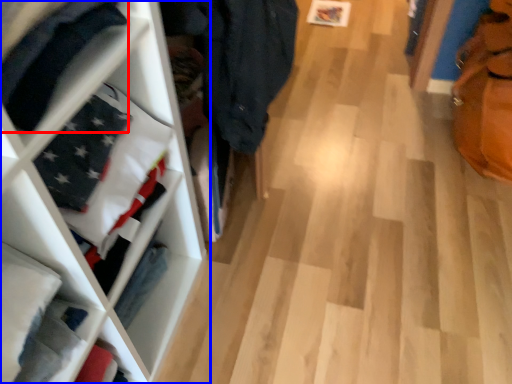
Question: Which object is closer to the camera taking this photo, clothing (highlighted by a red box) or shelf (highlighted by a blue box)?

Choices:
 (A) clothing
 (B) shelf

Answer: (A)